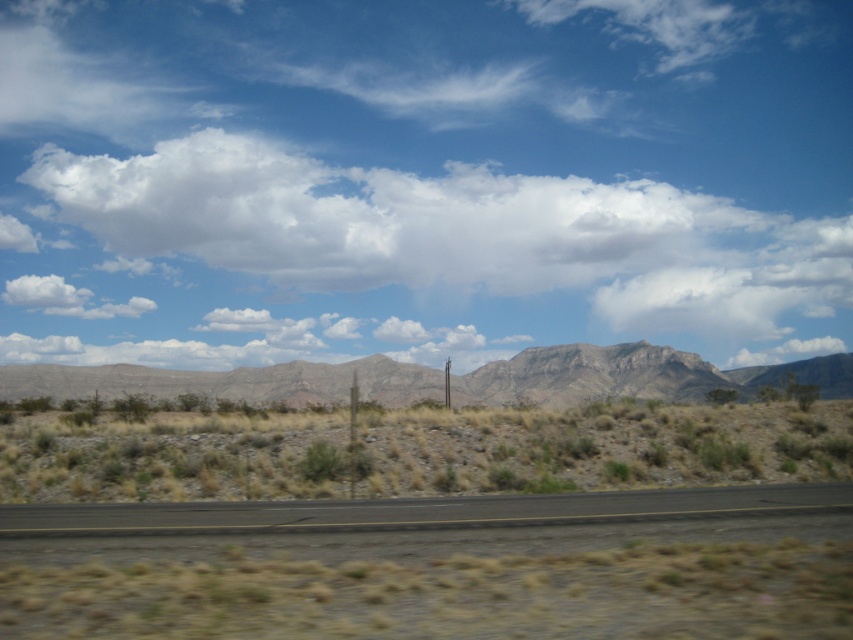
Question: Among these objects, which one is nearest to the camera?

Choices:
 (A) brown/dry grass at center
 (B) black asphalt highway at center
 (C) white fluffy cloud at upper center
 (D) rugged stone mountain at center

Answer: (B)

Question: Which of the following is the farthest from the observer?

Choices:
 (A) white fluffy cloud at upper center
 (B) black asphalt highway at center

Answer: (A)

Question: Considering the relative positions of white fluffy cloud at upper center and brown/dry grass at center in the image provided, where is white fluffy cloud at upper center located with respect to brown/dry grass at center?

Choices:
 (A) right
 (B) left

Answer: (A)

Question: Does white fluffy cloud at upper center have a smaller size compared to brown/dry grass at center?

Choices:
 (A) no
 (B) yes

Answer: (A)

Question: Is white fluffy cloud at upper center thinner than brown/dry grass at center?

Choices:
 (A) no
 (B) yes

Answer: (A)

Question: Which object appears closest to the camera in this image?

Choices:
 (A) black asphalt highway at center
 (B) white fluffy cloud at upper center
 (C) rugged stone mountain at center
 (D) brown/dry grass at center

Answer: (A)